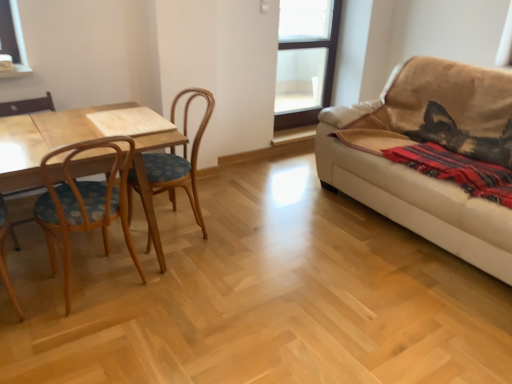
Locate an element on the screen. free area in between woodenchair at left and beige fabric couch at right is located at coordinates (306, 241).